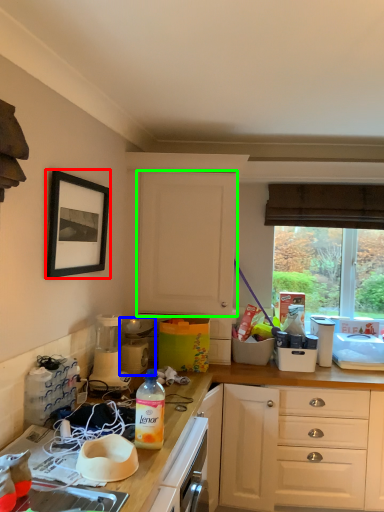
Question: Considering the real-world distances, which object is farthest from picture frame (highlighted by a red box)? appliance (highlighted by a blue box) or cabinetry (highlighted by a green box)?

Choices:
 (A) appliance
 (B) cabinetry

Answer: (A)